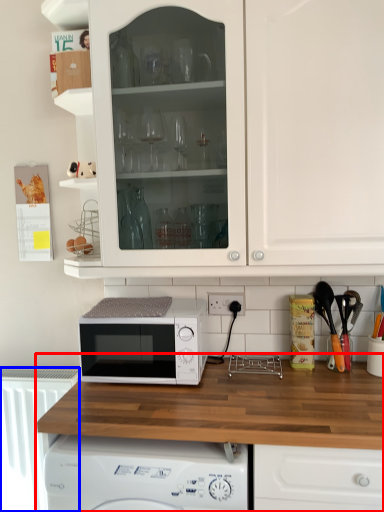
Question: Which of the following is the farthest to the observer, countertop (highlighted by a red box) or radiator (highlighted by a blue box)?

Choices:
 (A) countertop
 (B) radiator

Answer: (B)